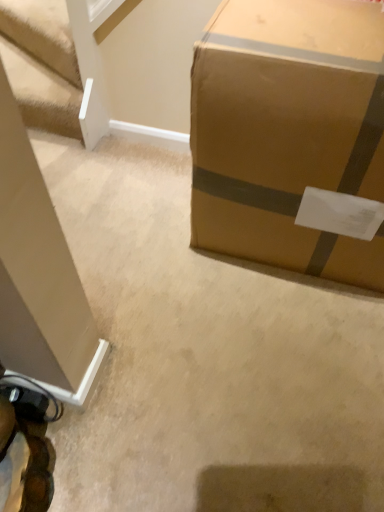
Question: In the image, is brown cardboard box at right on the left side or the right side of white textured stairwell at upper left?

Choices:
 (A) left
 (B) right

Answer: (B)

Question: Do you think brown cardboard box at right is within white textured stairwell at upper left, or outside of it?

Choices:
 (A) outside
 (B) inside

Answer: (A)

Question: From the image's perspective, is brown cardboard box at right above or below white textured stairwell at upper left?

Choices:
 (A) below
 (B) above

Answer: (A)

Question: Does point pos(6,65) appear closer or farther from the camera than point pos(375,278)?

Choices:
 (A) closer
 (B) farther

Answer: (B)

Question: Is white textured stairwell at upper left to the left or to the right of brown cardboard box at right in the image?

Choices:
 (A) right
 (B) left

Answer: (B)

Question: In terms of height, does white textured stairwell at upper left look taller or shorter compared to brown cardboard box at right?

Choices:
 (A) short
 (B) tall

Answer: (A)

Question: From a real-world perspective, is white textured stairwell at upper left positioned above or below brown cardboard box at right?

Choices:
 (A) above
 (B) below

Answer: (B)